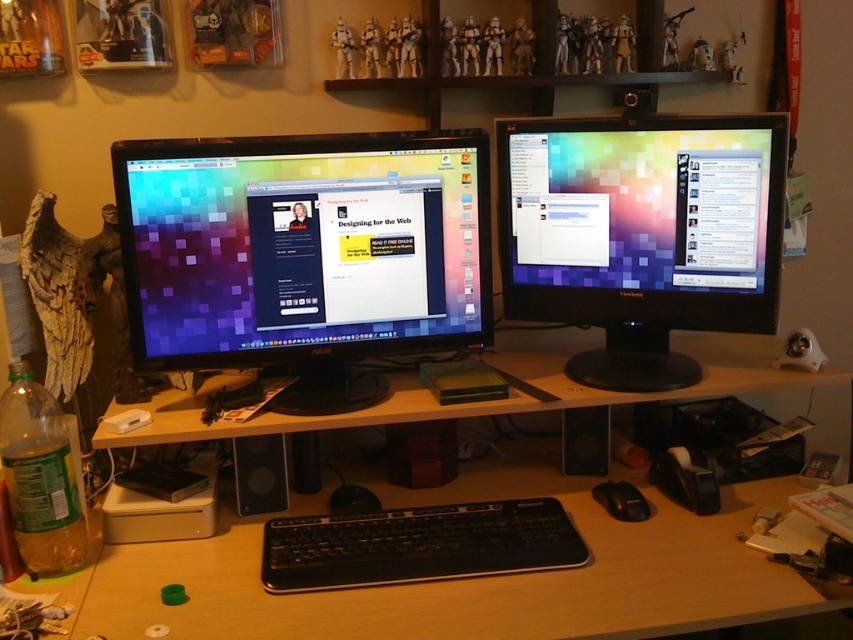
You are setting up a new keyboard and want to place it between the matte black monitor at center and the black matte mouse at center. Which side of the monitor should you place the keyboard to ensure it fits without overlapping either device?

The matte black monitor at center is wider than the black matte mouse at center, so placing the keyboard to the side of the monitor opposite the mouse would ensure it fits without overlapping.